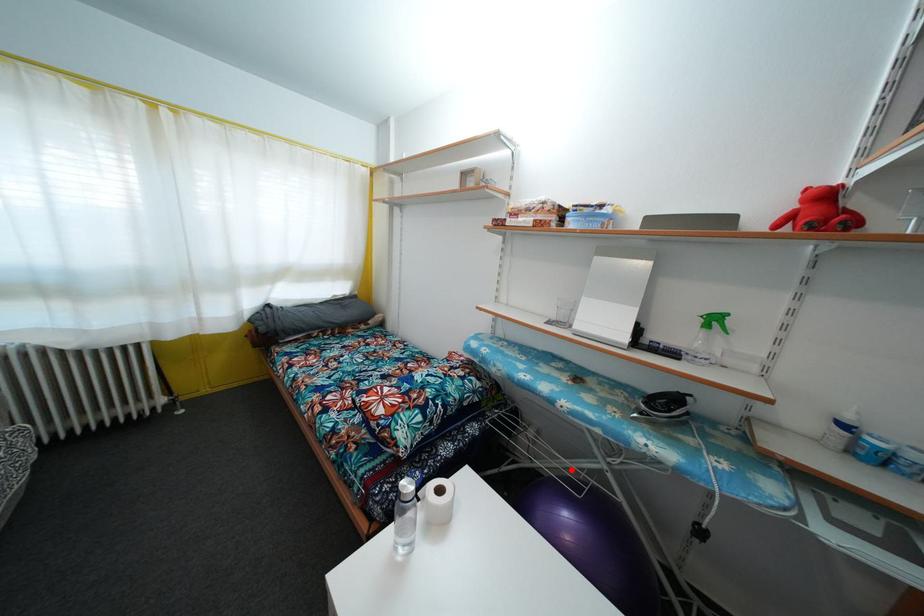
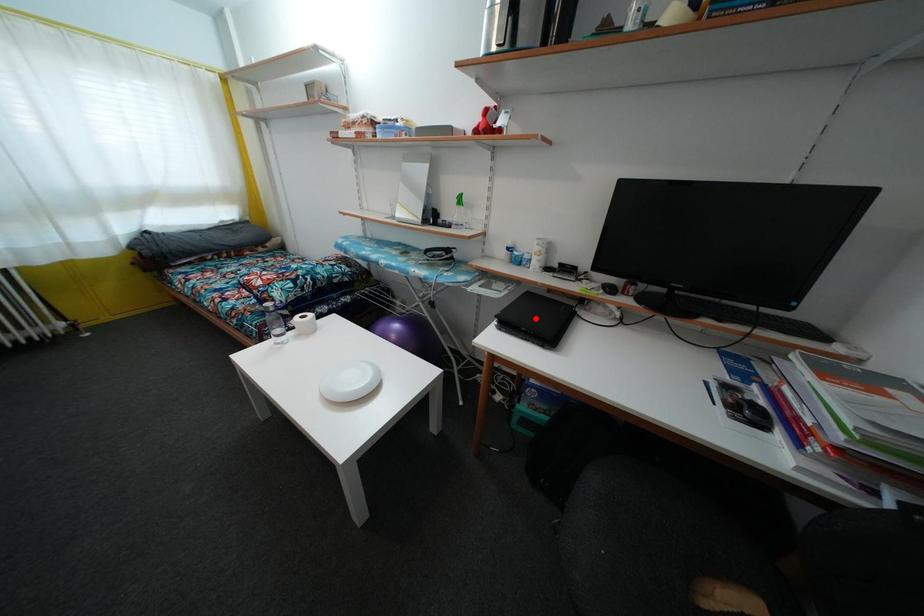
I am providing you with two images of the same scene from different viewpoints. A red point is marked on the first image and another point is marked on the second image. Do the highlighted points in image1 and image2 indicate the same real-world spot?

No